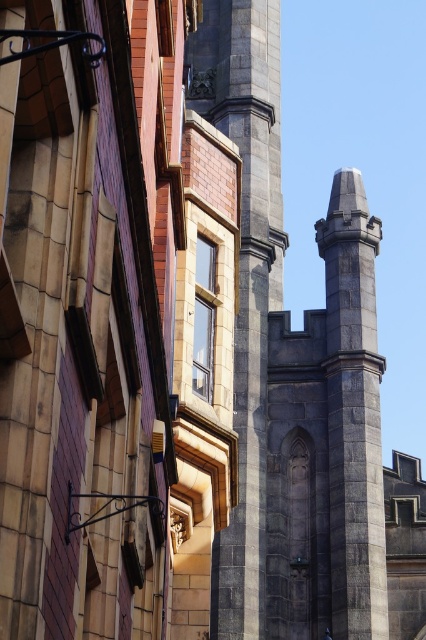
Question: Which object appears closest to the camera in this image?

Choices:
 (A) gray stone pillar at center
 (B) gray stone tower at center

Answer: (B)

Question: Is gray stone tower at center smaller than gray stone pillar at center?

Choices:
 (A) yes
 (B) no

Answer: (B)

Question: Does gray stone tower at center lie in front of gray stone pillar at center?

Choices:
 (A) no
 (B) yes

Answer: (B)

Question: From the image, what is the correct spatial relationship of gray stone tower at center in relation to gray stone pillar at center?

Choices:
 (A) below
 (B) above

Answer: (B)